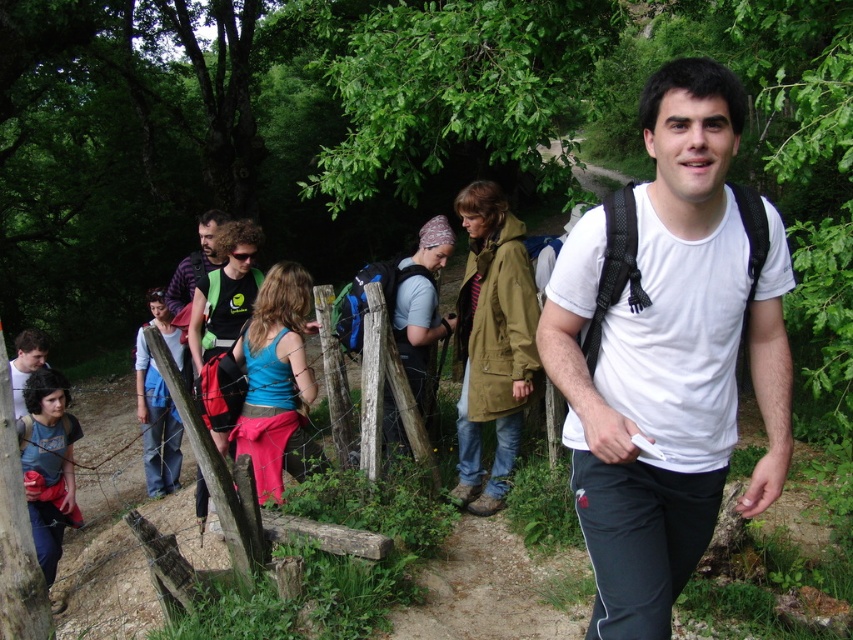
Can you confirm if olive-green fabric jacket at center is thinner than matte gray shirt at center?

In fact, olive-green fabric jacket at center might be wider than matte gray shirt at center.

Between olive-green fabric jacket at center and matte gray shirt at center, which one is positioned higher?

matte gray shirt at center is higher up.

Which is in front, point (523, 310) or point (439, 221)?

Point (523, 310) is more forward.

Locate an element on the screen. olive-green fabric jacket at center is located at coordinates (492, 342).

Is white matte t-shirt at center bigger than olive-green fabric jacket at center?

Yes, white matte t-shirt at center is bigger than olive-green fabric jacket at center.

Does point (607, 593) come behind point (494, 230)?

No, it is in front of (494, 230).

Which is behind, point (706, 257) or point (498, 275)?

Positioned behind is point (498, 275).

This screenshot has width=853, height=640. What are the coordinates of `white matte t-shirt at center` in the screenshot? It's located at (666, 353).

Is white matte t-shirt at center wider than wooden fence at center?

No.

In the scene shown: Is white matte t-shirt at center further to the viewer compared to wooden fence at center?

That is False.

This screenshot has height=640, width=853. I want to click on white matte t-shirt at center, so click(666, 353).